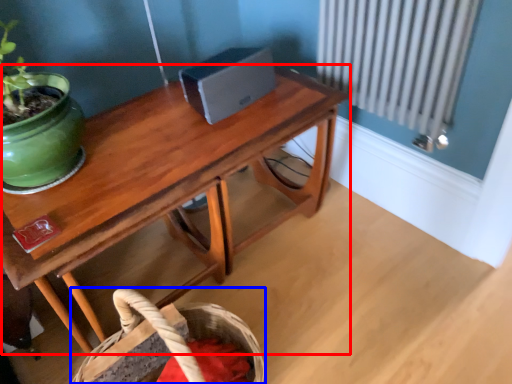
Question: Among these objects, which one is farthest to the camera, table (highlighted by a red box) or basket (highlighted by a blue box)?

Choices:
 (A) table
 (B) basket

Answer: (B)